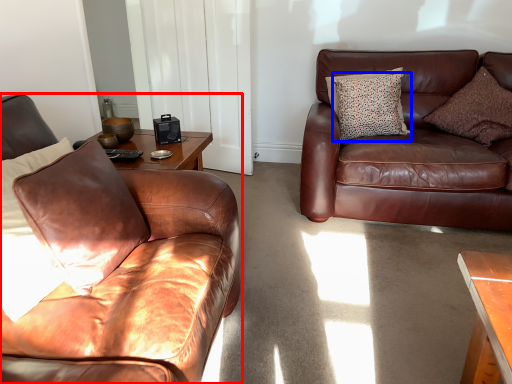
Question: Which point is further to the camera, studio couch (highlighted by a red box) or pillow (highlighted by a blue box)?

Choices:
 (A) studio couch
 (B) pillow

Answer: (B)